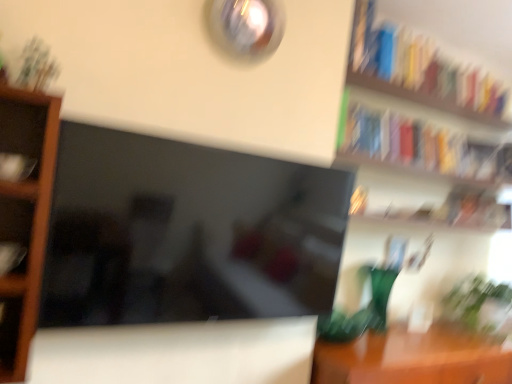
Question: Can you confirm if green leafy plant at lower right is taller than matte black book at left, which is the 3th book from top to bottom?

Choices:
 (A) no
 (B) yes

Answer: (B)

Question: Is green leafy plant at lower right positioned with its back to matte black book at left, which appears as the 2th book when viewed from the left?

Choices:
 (A) yes
 (B) no

Answer: (B)

Question: Does green leafy plant at lower right turn towards matte black book at left, marked as the first book in a front-to-back arrangement?

Choices:
 (A) yes
 (B) no

Answer: (B)

Question: From a real-world perspective, is green leafy plant at lower right physically below matte black book at left, which is counted as the second book, starting from the bottom?

Choices:
 (A) no
 (B) yes

Answer: (B)

Question: Is the depth of green leafy plant at lower right less than that of matte black book at left, which is the 3th book from top to bottom?

Choices:
 (A) yes
 (B) no

Answer: (B)

Question: Considering the relative sizes of green leafy plant at lower right and matte black book at left, which is counted as the second book, starting from the bottom, in the image provided, is green leafy plant at lower right wider than matte black book at left, which is counted as the second book, starting from the bottom,?

Choices:
 (A) no
 (B) yes

Answer: (B)

Question: From a real-world perspective, is hardcover book at upper right, arranged as the second book when viewed from the top, on top of hardcover book at upper right, arranged as the first book when viewed from the top?

Choices:
 (A) no
 (B) yes

Answer: (A)

Question: Does hardcover book at upper right, the third book when ordered from left to right, have a lesser height compared to hardcover book at upper right, which appears as the third book when viewed from the front?

Choices:
 (A) no
 (B) yes

Answer: (A)

Question: Can you confirm if hardcover book at upper right, the first book positioned from the back, is positioned to the right of hardcover book at upper right, the 2th book when ordered from back to front?

Choices:
 (A) no
 (B) yes

Answer: (A)

Question: Is there a large distance between hardcover book at upper right, positioned as the 2th book in right-to-left order, and hardcover book at upper right, which is counted as the fourth book, starting from the bottom?

Choices:
 (A) no
 (B) yes

Answer: (A)

Question: Can you confirm if hardcover book at upper right, arranged as the second book when viewed from the top, is taller than hardcover book at upper right, arranged as the first book when viewed from the top?

Choices:
 (A) yes
 (B) no

Answer: (A)

Question: Considering the relative sizes of hardcover book at upper right, positioned as the 2th book in right-to-left order, and hardcover book at upper right, the 2th book when ordered from back to front, in the image provided, is hardcover book at upper right, positioned as the 2th book in right-to-left order, smaller than hardcover book at upper right, the 2th book when ordered from back to front,?

Choices:
 (A) no
 (B) yes

Answer: (B)

Question: From a real-world perspective, is matte black book at left, which is the 4th book in right-to-left order, below brown wooden shelf at left?

Choices:
 (A) yes
 (B) no

Answer: (A)